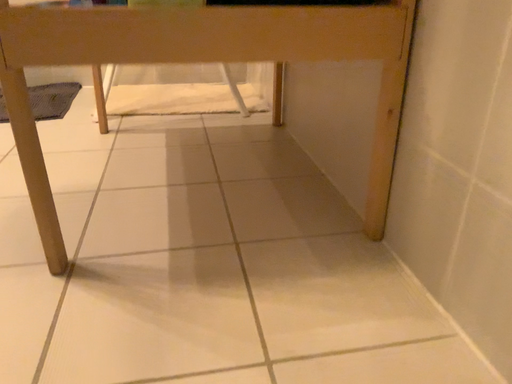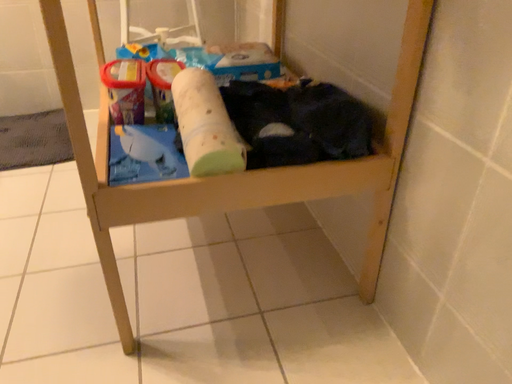
Question: Which way did the camera rotate in the video?

Choices:
 (A) rotated upward
 (B) rotated downward

Answer: (B)